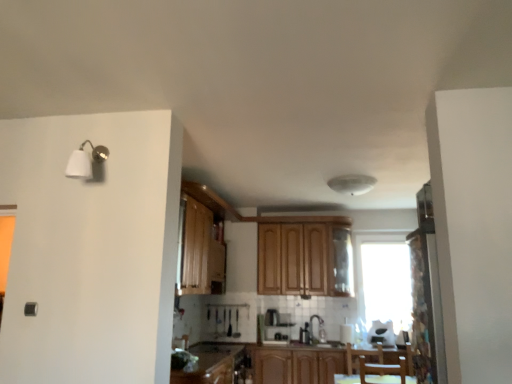
Find the location of `wooden cabinets at center, which is the first cabinetry from bottom to top`. wooden cabinets at center, which is the first cabinetry from bottom to top is located at coordinates (264, 364).

The width and height of the screenshot is (512, 384). I want to click on white matte wall sconce at upper left, so [x=87, y=162].

Looking at this image, measure the distance between point (97, 148) and camera.

A distance of 8.57 feet exists between point (97, 148) and camera.

In order to face patterned fabric screen door at right, should I rotate leftwards or rightwards?

Turn right by 20.569 degrees to look at patterned fabric screen door at right.

What is the approximate height of wooden cabinet at center, which appears as the 1th cabinetry when viewed from the top?

wooden cabinet at center, which appears as the 1th cabinetry when viewed from the top, is 36.37 inches tall.

Image resolution: width=512 pixels, height=384 pixels. In order to click on white glossy sink at center in this screenshot , I will do coord(318,334).

Is white matte wall sconce at upper left smaller than wooden cabinet at lower center, arranged as the second cabinetry when ordered from the bottom?

Yes, white matte wall sconce at upper left is smaller than wooden cabinet at lower center, arranged as the second cabinetry when ordered from the bottom.

How many degrees apart are the facing directions of white matte wall sconce at upper left and wooden cabinet at lower center, arranged as the second cabinetry when ordered from the bottom?

89.6 degrees separate the facing orientations of white matte wall sconce at upper left and wooden cabinet at lower center, arranged as the second cabinetry when ordered from the bottom.

Looking at this image, is white matte wall sconce at upper left inside the boundaries of wooden cabinet at lower center, arranged as the second cabinetry when ordered from the bottom, or outside?

white matte wall sconce at upper left is not enclosed by wooden cabinet at lower center, arranged as the second cabinetry when ordered from the bottom.

Based on the photo, from the image's perspective, is white matte wall sconce at upper left beneath wooden cabinet at lower center, arranged as the second cabinetry when ordered from the bottom?

No, from the image's perspective, white matte wall sconce at upper left is not below wooden cabinet at lower center, arranged as the second cabinetry when ordered from the bottom.

From the image's perspective, between white glossy sink at center and wooden cabinet at center, the 3th cabinetry from the bottom, which one is located above?

wooden cabinet at center, the 3th cabinetry from the bottom, from the image's perspective.

Is point (323, 338) closer or farther from the camera than point (295, 238)?

Point (323, 338).

In the image, is white glossy sink at center on the left side or the right side of wooden cabinet at center, which appears as the 1th cabinetry when viewed from the top?

From the image, it's evident that white glossy sink at center is to the right of wooden cabinet at center, which appears as the 1th cabinetry when viewed from the top.

Is satin silver coffee machine at center positioned with its back to wooden cabinets at center, which is the first cabinetry from bottom to top?

That's not correct — satin silver coffee machine at center is not looking away from wooden cabinets at center, which is the first cabinetry from bottom to top.

Considering the sizes of satin silver coffee machine at center and wooden cabinets at center, which is the first cabinetry from bottom to top, in the image, is satin silver coffee machine at center taller or shorter than wooden cabinets at center, which is the first cabinetry from bottom to top,?

In the image, satin silver coffee machine at center appears to be shorter than wooden cabinets at center, which is the first cabinetry from bottom to top.

Which is correct: satin silver coffee machine at center is inside wooden cabinets at center, which is the first cabinetry from bottom to top, or outside of it?

The correct answer is: outside.

Is satin silver coffee machine at center far from wooden cabinets at center, positioned as the 3th cabinetry in top-to-bottom order?

That's not correct — satin silver coffee machine at center is a little close to wooden cabinets at center, positioned as the 3th cabinetry in top-to-bottom order.

Consider the image. Who is taller, white glossy sink at center or patterned fabric screen door at right?

With more height is patterned fabric screen door at right.

Looking at this image, which object is wider, white glossy sink at center or patterned fabric screen door at right?

white glossy sink at center.

Is white glossy sink at center not inside patterned fabric screen door at right?

Yes, white glossy sink at center is located beyond the bounds of patterned fabric screen door at right.

From a real-world perspective, relative to patterned fabric screen door at right, is white glossy sink at center vertically above or below?

Clearly, from a real-world perspective, white glossy sink at center is below patterned fabric screen door at right.

Looking at this image, is brown wooden chair at lower center to the right of transparent glass window at center from the viewer's perspective?

No, brown wooden chair at lower center is not to the right of transparent glass window at center.

Considering the relative sizes of brown wooden chair at lower center and transparent glass window at center in the image provided, is brown wooden chair at lower center thinner than transparent glass window at center?

No, brown wooden chair at lower center is not thinner than transparent glass window at center.

Looking at this image, from a real-world perspective, is brown wooden chair at lower center over transparent glass window at center?

Actually, brown wooden chair at lower center is physically below transparent glass window at center in the real world.

Is brown wooden chair at lower center far from transparent glass window at center?

Yes.

Is brown wooden chair at lower center oriented towards white glossy toaster at center?

No, brown wooden chair at lower center does not turn towards white glossy toaster at center.

How many degrees apart are the facing directions of brown wooden chair at lower center and white glossy toaster at center?

30.7 degrees.

Between brown wooden chair at lower center and white glossy toaster at center, which one is positioned behind?

white glossy toaster at center is further from the camera.

Considering the positions of objects brown wooden chair at lower center and white glossy toaster at center in the image provided, who is more to the right, brown wooden chair at lower center or white glossy toaster at center?

white glossy toaster at center.

Considering the sizes of objects patterned fabric screen door at right and white glossy sink at center in the image provided, who is taller, patterned fabric screen door at right or white glossy sink at center?

With more height is patterned fabric screen door at right.

From the image's perspective, which one is positioned higher, patterned fabric screen door at right or white glossy sink at center?

patterned fabric screen door at right is shown above in the image.

How far apart are patterned fabric screen door at right and white glossy sink at center?

The distance of patterned fabric screen door at right from white glossy sink at center is 6.11 feet.

Does patterned fabric screen door at right turn towards white glossy sink at center?

No, patterned fabric screen door at right does not turn towards white glossy sink at center.

Find the location of a particular element. the 2nd cabinetry below the white matte wall sconce at upper left (from a real-world perspective) is located at coordinates (212, 363).

The height and width of the screenshot is (384, 512). I want to click on sink below the wooden cabinet at center, which appears as the 1th cabinetry when viewed from the top (from the image's perspective), so click(x=318, y=334).

Which object lies nearer to the anchor point satin silver coffee machine at center, patterned fabric screen door at right or transparent glass window at center?

transparent glass window at center.

Estimate the real-world distances between objects in this image. Which object is further from patterned fabric screen door at right, satin silver coffee machine at center or wooden cabinets at center, positioned as the 3th cabinetry in top-to-bottom order?

Based on the image, satin silver coffee machine at center appears to be further to patterned fabric screen door at right.

Which object lies further to the anchor point white matte wall sconce at upper left, white glossy sink at center or wooden cabinets at center, which is the first cabinetry from bottom to top?

Based on the image, white glossy sink at center appears to be further to white matte wall sconce at upper left.

Looking at the image, which one is located closer to brown wooden chair at lower center, wooden cabinets at center, positioned as the 3th cabinetry in top-to-bottom order, or white glossy sink at center?

The object closer to brown wooden chair at lower center is wooden cabinets at center, positioned as the 3th cabinetry in top-to-bottom order.

Based on their spatial positions, is wooden cabinet at lower center, which is the second cabinetry from top to bottom, or brown wooden chair at lower center further from patterned fabric screen door at right?

The object further to patterned fabric screen door at right is wooden cabinet at lower center, which is the second cabinetry from top to bottom.

Looking at the image, which one is located further to satin silver coffee machine at center, white glossy toaster at center or white matte wall sconce at upper left?

Among the two, white matte wall sconce at upper left is located further to satin silver coffee machine at center.

Which object lies further to the anchor point white glossy toaster at center, wooden cabinets at center, which is the first cabinetry from bottom to top, or white glossy sink at center?

wooden cabinets at center, which is the first cabinetry from bottom to top.

Which object lies further to the anchor point white glossy toaster at center, wooden cabinet at center, which appears as the 1th cabinetry when viewed from the top, or transparent glass window at center?

Based on the image, wooden cabinet at center, which appears as the 1th cabinetry when viewed from the top, appears to be further to white glossy toaster at center.

In order to click on sink between wooden cabinet at lower center, which is the second cabinetry from top to bottom, and white glossy toaster at center, in the horizontal direction in this screenshot , I will do `click(318, 334)`.

Where is `coffee machine between wooden cabinet at lower center, arranged as the second cabinetry when ordered from the bottom, and wooden cabinets at center, positioned as the 3th cabinetry in top-to-bottom order`? coffee machine between wooden cabinet at lower center, arranged as the second cabinetry when ordered from the bottom, and wooden cabinets at center, positioned as the 3th cabinetry in top-to-bottom order is located at coordinates (275, 327).

Find the location of a particular element. This screenshot has height=384, width=512. coffee machine between brown wooden chair at lower center and wooden cabinet at center, the 3th cabinetry from the bottom, along the z-axis is located at coordinates pos(275,327).

Locate an element on the screen. This screenshot has height=384, width=512. appliance between white matte wall sconce at upper left and transparent glass window at center along the z-axis is located at coordinates (382, 333).